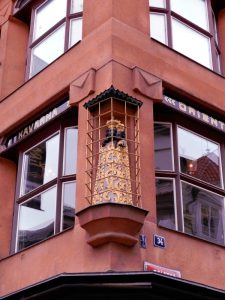
This screenshot has width=225, height=300. I want to click on divider between top floor and next floor down, so click(x=12, y=108), click(x=214, y=87), click(x=101, y=46), click(x=135, y=58).